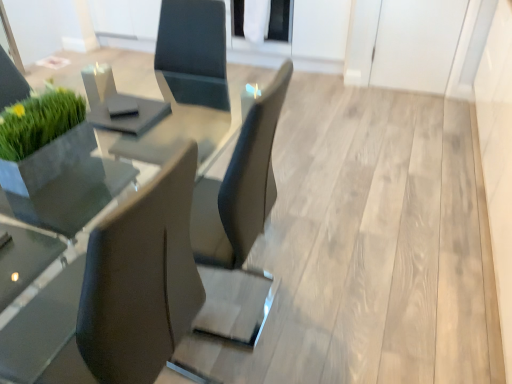
In order to face matte black chair at left, should I rotate leftwards or rightwards?

To align with it, rotate left about 20.118°.

Describe the element at coordinates (115, 295) in the screenshot. I see `matte black chair at left` at that location.

Describe the element at coordinates (279, 22) in the screenshot. The height and width of the screenshot is (384, 512). I see `transparent glass door at upper center` at that location.

Identify the location of matte black chair at left. This screenshot has height=384, width=512. (115, 295).

Is clear glass table at center a part of transparent glass door at upper center?

No, clear glass table at center is located outside of transparent glass door at upper center.

Does transparent glass door at upper center have a larger size compared to clear glass table at center?

No, transparent glass door at upper center is not bigger than clear glass table at center.

What's the angular difference between transparent glass door at upper center and clear glass table at center's facing directions?

The facing directions of transparent glass door at upper center and clear glass table at center are 89 degrees apart.

Is point (277, 7) closer or farther from the camera than point (241, 85)?

Clearly, point (277, 7) is closer to the camera than point (241, 85).

From a real-world perspective, which object rests below the other?

transparent glass door at upper center.

Is transparent glass door at upper center placed right next to matte black chair at left?

transparent glass door at upper center is not next to matte black chair at left, and they're not touching.

Identify the location of chair located above the transparent glass door at upper center (from a real-world perspective). The width and height of the screenshot is (512, 384). (115, 295).

Considering the relative sizes of transparent glass door at upper center and matte black chair at left in the image provided, is transparent glass door at upper center smaller than matte black chair at left?

Yes, transparent glass door at upper center is smaller than matte black chair at left.

Can you tell me how much matte black chair at left and clear glass table at center differ in facing direction?

5.56 degrees separate the facing orientations of matte black chair at left and clear glass table at center.

Is the position of matte black chair at left more distant than that of clear glass table at center?

No, matte black chair at left is in front of clear glass table at center.

Is clear glass table at center completely or partially inside matte black chair at left?

No, clear glass table at center is not inside matte black chair at left.

What are the coordinates of `glass door to the right of clear glass table at center` in the screenshot? It's located at (279, 22).

Between clear glass table at center and transparent glass door at upper center, which one appears on the left side from the viewer's perspective?

clear glass table at center is more to the left.

From the picture: Considering the sizes of objects clear glass table at center and transparent glass door at upper center in the image provided, who is bigger, clear glass table at center or transparent glass door at upper center?

clear glass table at center is bigger.

From the image's perspective, between matte black chair at left and transparent glass door at upper center, which one is located above?

transparent glass door at upper center.

Between matte black chair at left and transparent glass door at upper center, which one appears on the left side from the viewer's perspective?

matte black chair at left.

Would you say matte black chair at left is outside transparent glass door at upper center?

matte black chair at left lies outside transparent glass door at upper center's area.

Is matte black chair at left wider than transparent glass door at upper center?

Incorrect, the width of matte black chair at left does not surpass that of transparent glass door at upper center.

Is clear glass table at center aimed at matte black chair at left?

No, clear glass table at center is not aimed at matte black chair at left.

Which object is closer to the camera taking this photo, clear glass table at center or matte black chair at left?

Result: matte black chair at left.

Considering the positions of points (77, 218) and (70, 372), is point (77, 218) farther from camera compared to point (70, 372)?

Yes, it is.

Identify the location of glass door above the clear glass table at center (from a real-world perspective). The width and height of the screenshot is (512, 384). (279, 22).

Find the location of a particular element. glass door above the matte black chair at left (from the image's perspective) is located at coordinates (279, 22).

When comparing their distances from transparent glass door at upper center, does clear glass table at center or matte black chair at left seem further?

The object further to transparent glass door at upper center is matte black chair at left.

Which object lies nearer to the anchor point clear glass table at center, transparent glass door at upper center or matte black chair at left?

matte black chair at left lies closer to clear glass table at center than the other object.

Based on the photo, estimate the real-world distances between objects in this image. Which object is further from transparent glass door at upper center, matte black chair at left or clear glass table at center?

matte black chair at left is positioned further to the anchor transparent glass door at upper center.

Looking at the image, which one is located further to clear glass table at center, matte black chair at left or transparent glass door at upper center?

transparent glass door at upper center lies further to clear glass table at center than the other object.

From the picture: Considering their positions, is clear glass table at center positioned further to matte black chair at left than transparent glass door at upper center?

transparent glass door at upper center is positioned further to the anchor matte black chair at left.

Estimate the real-world distances between objects in this image. Which object is further from matte black chair at left, transparent glass door at upper center or clear glass table at center?

transparent glass door at upper center.

You are a GUI agent. You are given a task and a screenshot of the screen. Output one action in this format:
    pyautogui.click(x=<x>, y=<y>)
    Task: Click on the round table positioned between matte black chair at left and transparent glass door at upper center from near to far
    
    Given the screenshot: What is the action you would take?
    pyautogui.click(x=58, y=207)